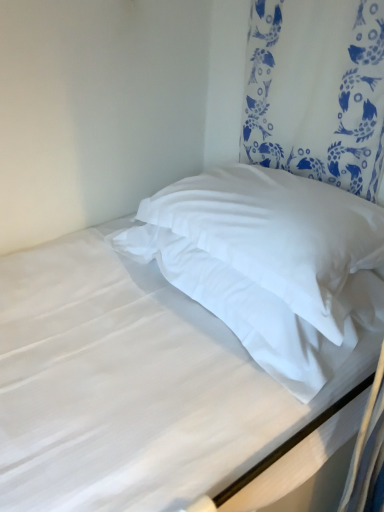
Question: Considering the relative sizes of white smooth pillow at upper right and white soft pillow at center, which is the first pillow from bottom to top, in the image provided, is white smooth pillow at upper right shorter than white soft pillow at center, which is the first pillow from bottom to top,?

Choices:
 (A) no
 (B) yes

Answer: (A)

Question: Is white smooth pillow at upper right looking in the opposite direction of white soft pillow at center, which is the first pillow from bottom to top?

Choices:
 (A) yes
 (B) no

Answer: (B)

Question: Is white smooth pillow at upper right at the right side of white soft pillow at center, the second pillow positioned from the top?

Choices:
 (A) yes
 (B) no

Answer: (B)

Question: Can you confirm if white smooth pillow at upper right is thinner than white soft pillow at center, the second pillow positioned from the top?

Choices:
 (A) no
 (B) yes

Answer: (A)

Question: Is the depth of white smooth pillow at upper right greater than that of white soft pillow at center, which is the first pillow from bottom to top?

Choices:
 (A) yes
 (B) no

Answer: (B)

Question: Does white smooth pillow at upper right turn towards white soft pillow at center, which is the first pillow from bottom to top?

Choices:
 (A) yes
 (B) no

Answer: (B)

Question: From a real-world perspective, is white soft pillow at center, which appears as the 2th pillow when ordered from the bottom, on white smooth pillow at upper right?

Choices:
 (A) no
 (B) yes

Answer: (B)

Question: Is white soft pillow at center, positioned as the 1th pillow in top-to-bottom order, taller than white smooth pillow at upper right?

Choices:
 (A) no
 (B) yes

Answer: (A)

Question: Is white soft pillow at center, positioned as the 1th pillow in top-to-bottom order, in contact with white smooth pillow at upper right?

Choices:
 (A) no
 (B) yes

Answer: (A)

Question: Considering the relative sizes of white soft pillow at center, positioned as the 1th pillow in top-to-bottom order, and white smooth pillow at upper right in the image provided, is white soft pillow at center, positioned as the 1th pillow in top-to-bottom order, wider than white smooth pillow at upper right?

Choices:
 (A) no
 (B) yes

Answer: (A)

Question: Does white soft pillow at center, positioned as the 1th pillow in top-to-bottom order, have a lesser height compared to white smooth pillow at upper right?

Choices:
 (A) yes
 (B) no

Answer: (A)

Question: Does white soft pillow at center, positioned as the 1th pillow in top-to-bottom order, have a larger size compared to white smooth pillow at upper right?

Choices:
 (A) yes
 (B) no

Answer: (B)

Question: Considering the relative positions of white fabric curtain at upper right and white soft pillow at center, which appears as the 2th pillow when ordered from the bottom, in the image provided, is white fabric curtain at upper right to the right of white soft pillow at center, which appears as the 2th pillow when ordered from the bottom, from the viewer's perspective?

Choices:
 (A) no
 (B) yes

Answer: (B)